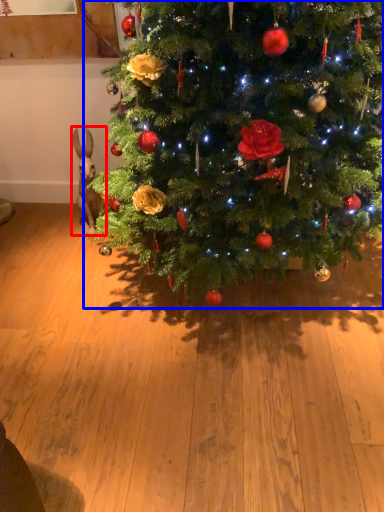
Question: Which object is further to the camera taking this photo, animal (highlighted by a red box) or christmas tree (highlighted by a blue box)?

Choices:
 (A) animal
 (B) christmas tree

Answer: (A)